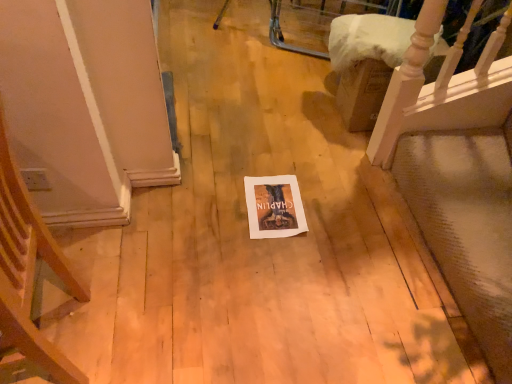
The width and height of the screenshot is (512, 384). I want to click on spots to the right of wooden armchair at left, so click(168, 327).